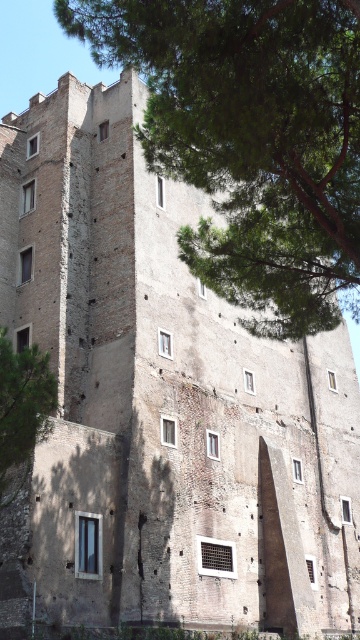
You are standing in front of the historic stone building and notice two green leafy trees. Which tree, the green leafy tree at upper center or the green leafy tree at left, is positioned higher up on the building?

The green leafy tree at upper center is positioned higher up on the building than the green leafy tree at left.

Looking at this image, you are standing in front of the historic stone building and want to take a photo of both the green leafy tree at upper center and the green leafy tree at left. Which tree should you focus on first to ensure both are in the frame?

You should focus on the green leafy tree at upper center first because it is closer to the viewer than the green leafy tree at left, so adjusting the camera to capture it will also include the farther tree in the background.